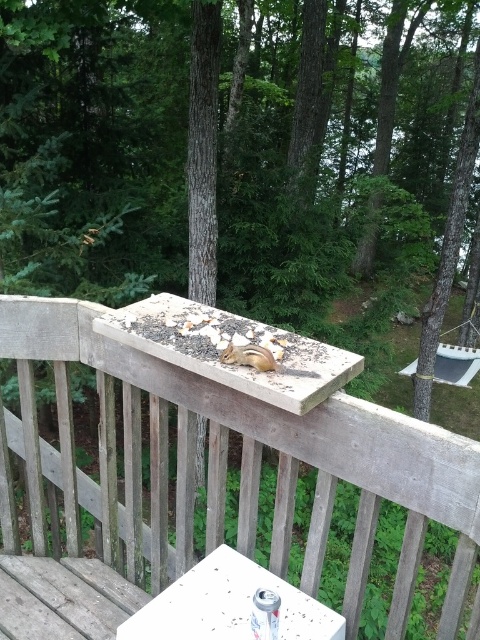
Question: Is white plastic table at lower center thinner than gray fur squirrel at center?

Choices:
 (A) yes
 (B) no

Answer: (B)

Question: Which object appears closest to the camera in this image?

Choices:
 (A) white plastic table at lower center
 (B) gray fur squirrel at center
 (C) wooden rail at upper center

Answer: (C)

Question: Which of the following is the farthest from the observer?

Choices:
 (A) wooden rail at upper center
 (B) white plastic table at lower center

Answer: (B)

Question: Does white plastic table at lower center appear on the left side of gray fur squirrel at center?

Choices:
 (A) yes
 (B) no

Answer: (A)

Question: Estimate the real-world distances between objects in this image. Which object is farther from the white plastic table at lower center?

Choices:
 (A) gray fur squirrel at center
 (B) wooden rail at upper center

Answer: (A)

Question: Can you confirm if wooden rail at upper center is positioned below white plastic table at lower center?

Choices:
 (A) no
 (B) yes

Answer: (B)